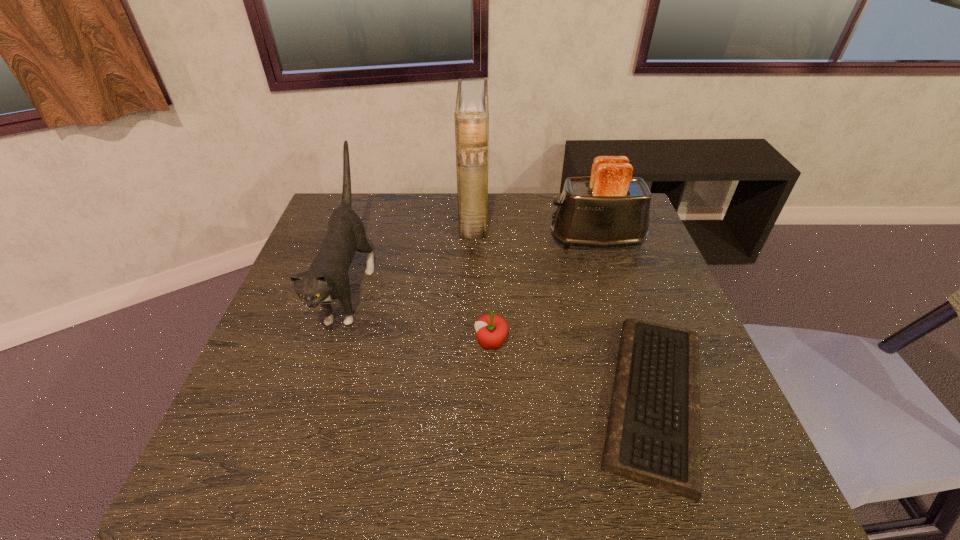
At what (x,y) coordinates should I click in order to perform the action: click on free space between the computer keyboard and the phonebook. Please return your answer as a coordinate pair (x, y). The image size is (960, 540). Looking at the image, I should click on click(x=564, y=308).

The width and height of the screenshot is (960, 540). Find the location of `free area in between the computer keyboard and the third tallest object`. free area in between the computer keyboard and the third tallest object is located at coordinates (625, 319).

Identify which object is located as the fourth nearest to the fourth shortest object. Please provide its 2D coordinates. Your answer should be formatted as a tuple, i.e. [(x, y)], where the tuple contains the x and y coordinates of a point satisfying the conditions above.

[(653, 437)]

Locate which object is the fourth closest to the cat. Please provide its 2D coordinates. Your answer should be formatted as a tuple, i.e. [(x, y)], where the tuple contains the x and y coordinates of a point satisfying the conditions above.

[(653, 437)]

Find the location of a particular element. The width and height of the screenshot is (960, 540). vacant point that satisfies the following two spatial constraints: 1. on the side of the shortest object with the control lever; 2. on the right side of the toaster is located at coordinates click(647, 399).

I want to click on blank area in the image that satisfies the following two spatial constraints: 1. on the cover of the phonebook; 2. at the face of the cat, so click(472, 289).

Where is `vacant position in the image that satisfies the following two spatial constraints: 1. on the back side of the computer keyboard; 2. on the cover of the phonebook`? vacant position in the image that satisfies the following two spatial constraints: 1. on the back side of the computer keyboard; 2. on the cover of the phonebook is located at coordinates (593, 217).

Locate an element on the screen. vacant space that satisfies the following two spatial constraints: 1. at the face of the second shortest object; 2. on the right side of the leftmost object is located at coordinates (332, 343).

Locate an element on the screen. Image resolution: width=960 pixels, height=540 pixels. vacant position in the image that satisfies the following two spatial constraints: 1. on the side of the third tallest object with the control lever; 2. at the face of the second tallest object is located at coordinates (612, 289).

Find the location of `free space that satisfies the following two spatial constraints: 1. on the back side of the fourth tallest object; 2. on the cover of the tallest object`. free space that satisfies the following two spatial constraints: 1. on the back side of the fourth tallest object; 2. on the cover of the tallest object is located at coordinates (488, 217).